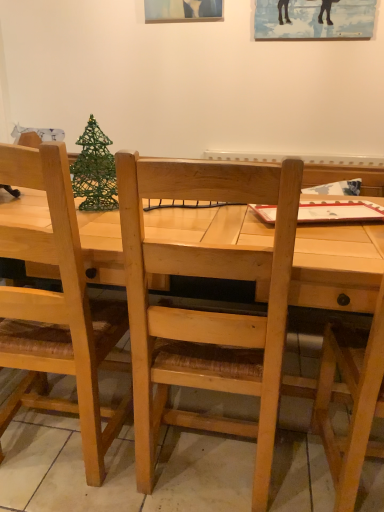
Question: From a real-world perspective, is green wire christmas tree at upper left on top of light wood table at center?

Choices:
 (A) yes
 (B) no

Answer: (A)

Question: From a real-world perspective, is green wire christmas tree at upper left beneath light wood table at center?

Choices:
 (A) no
 (B) yes

Answer: (A)

Question: Considering the relative sizes of green wire christmas tree at upper left and light wood table at center in the image provided, is green wire christmas tree at upper left thinner than light wood table at center?

Choices:
 (A) no
 (B) yes

Answer: (B)

Question: Could you tell me if green wire christmas tree at upper left is facing light wood table at center?

Choices:
 (A) yes
 (B) no

Answer: (B)

Question: Considering the relative positions of green wire christmas tree at upper left and light wood table at center in the image provided, is green wire christmas tree at upper left to the left of light wood table at center from the viewer's perspective?

Choices:
 (A) no
 (B) yes

Answer: (B)

Question: Is green wire christmas tree at upper left not within light wood table at center?

Choices:
 (A) yes
 (B) no

Answer: (A)

Question: Is light wood table at center shorter than natural wood chair at right, placed as the 2th chair when sorted from left to right?

Choices:
 (A) yes
 (B) no

Answer: (A)

Question: From a real-world perspective, is light wood table at center positioned over natural wood chair at right, placed as the 2th chair when sorted from left to right, based on gravity?

Choices:
 (A) yes
 (B) no

Answer: (B)

Question: Would you say light wood table at center contains natural wood chair at right, placed as the 2th chair when sorted from left to right?

Choices:
 (A) yes
 (B) no

Answer: (A)

Question: Can you confirm if light wood table at center is taller than natural wood chair at right, which is the first chair from right to left?

Choices:
 (A) no
 (B) yes

Answer: (A)

Question: Can you confirm if light wood table at center is positioned to the right of natural wood chair at right, placed as the 2th chair when sorted from left to right?

Choices:
 (A) yes
 (B) no

Answer: (B)

Question: From the image's perspective, does light wood table at center appear lower than natural wood chair at right, which is the first chair from right to left?

Choices:
 (A) yes
 (B) no

Answer: (B)

Question: Could you tell me if natural wood chair at right, placed as the 2th chair when sorted from left to right, is facing green wire christmas tree at upper left?

Choices:
 (A) yes
 (B) no

Answer: (B)